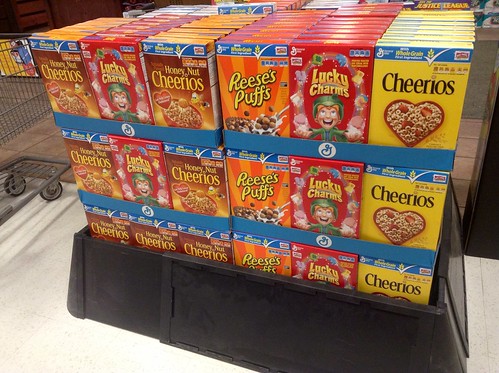
This screenshot has width=499, height=373. Find the location of `cheerios cereal box`. cheerios cereal box is located at coordinates (403, 281), (399, 207), (432, 112), (424, 37), (411, 31), (411, 26), (412, 23), (414, 19), (415, 14).